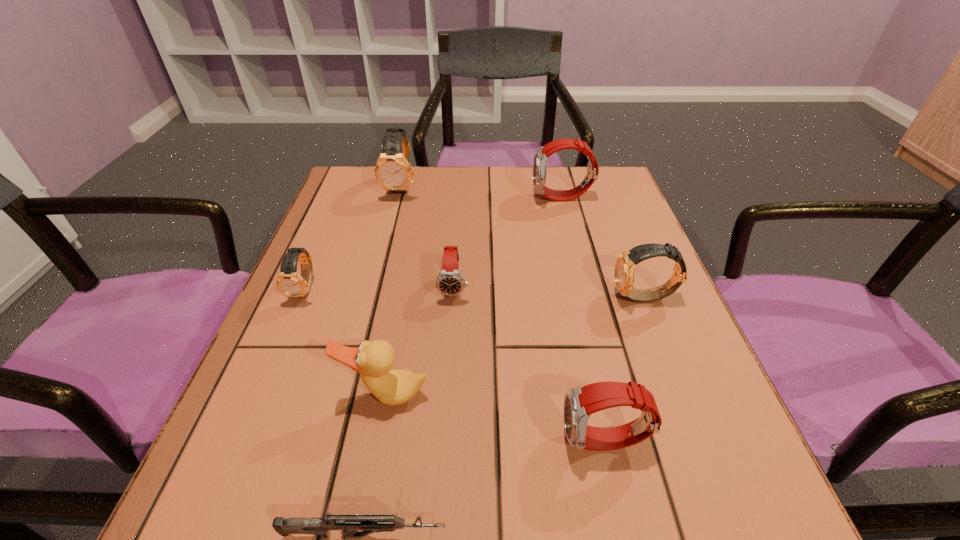
This screenshot has width=960, height=540. I want to click on free area in between the second smallest gold watch and the leftmost gold watch, so click(475, 293).

At what (x,y) coordinates should I click in order to perform the action: click on empty location between the leftmost object and the duck. Please return your answer as a coordinate pair (x, y). This screenshot has height=540, width=960. Looking at the image, I should click on (346, 342).

You are a GUI agent. You are given a task and a screenshot of the screen. Output one action in this format:
    pyautogui.click(x=<x>, y=<y>)
    Task: Click on the empty space between the duck and the rightmost gold watch
    The image size is (960, 540).
    Given the screenshot: What is the action you would take?
    pyautogui.click(x=516, y=346)

Locate an element on the screen. The width and height of the screenshot is (960, 540). vacant space in between the second gold watch from right to left and the biggest red watch is located at coordinates (482, 192).

The image size is (960, 540). Identify the location of object identified as the third closest to the second watch from left to right. (540, 158).

Locate an element on the screen. object that can be found as the sixth closest to the farthest red watch is located at coordinates (580, 402).

Identify which watch is located as the nearest to the second biggest gold watch. Please provide its 2D coordinates. Your answer should be formatted as a tuple, i.e. [(x, y)], where the tuple contains the x and y coordinates of a point satisfying the conditions above.

[(580, 402)]

Select which watch appears as the fifth closest to the second nearest object. Please provide its 2D coordinates. Your answer should be formatted as a tuple, i.e. [(x, y)], where the tuple contains the x and y coordinates of a point satisfying the conditions above.

[(393, 171)]

The width and height of the screenshot is (960, 540). I want to click on gold watch that stands as the third closest to the biggest red watch, so click(x=289, y=282).

Locate which gold watch is the second closest to the smallest gold watch. Please provide its 2D coordinates. Your answer should be formatted as a tuple, i.e. [(x, y)], where the tuple contains the x and y coordinates of a point satisfying the conditions above.

[(625, 265)]